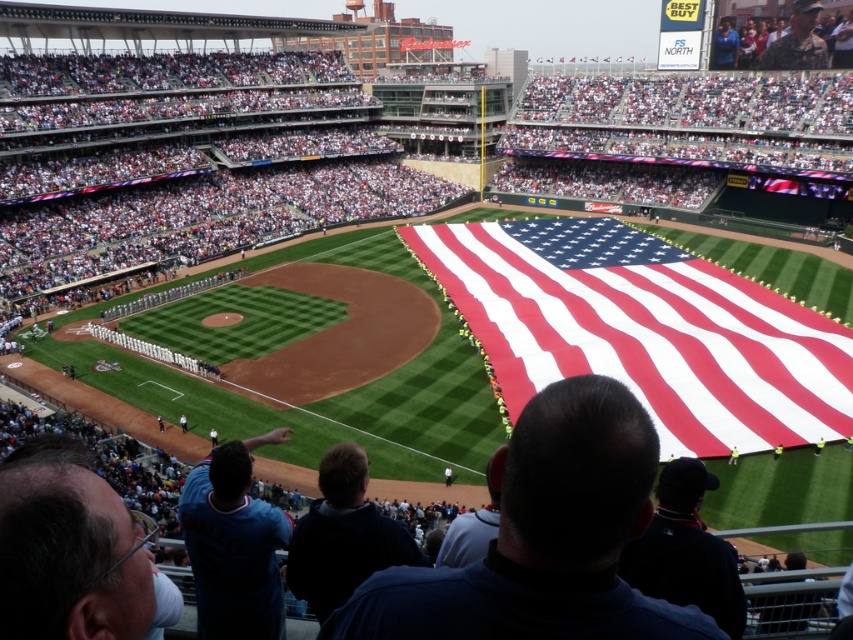
Who is higher up, red-white striped fabric at center or yellow fabric at lower right?

red-white striped fabric at center

Is red-white striped fabric at center smaller than yellow fabric at lower right?

No, red-white striped fabric at center is not smaller than yellow fabric at lower right.

Which is in front, point (825, 323) or point (735, 451)?

Point (735, 451) is in front.

Image resolution: width=853 pixels, height=640 pixels. Find the location of `red-white striped fabric at center`. red-white striped fabric at center is located at coordinates (643, 330).

Which of these two, red-white striped fabric at center or blue jersey at lower left, stands taller?

With more height is red-white striped fabric at center.

In the scene shown: Who is more distant from viewer, (511, 301) or (285, 541)?

The point (511, 301) is more distant.

Is point (734, 310) in front of point (253, 616)?

No, (734, 310) is behind (253, 616).

At what (x,y) coordinates should I click in order to perform the action: click on red-white striped fabric at center. Please return your answer as a coordinate pair (x, y). Image resolution: width=853 pixels, height=640 pixels. Looking at the image, I should click on (643, 330).

Is blue jersey at lower left above yellow fabric at lower right?

Indeed, blue jersey at lower left is positioned over yellow fabric at lower right.

Is blue jersey at lower left to the left of yellow fabric at lower right from the viewer's perspective?

Correct, you'll find blue jersey at lower left to the left of yellow fabric at lower right.

Locate an element on the screen. The height and width of the screenshot is (640, 853). blue jersey at lower left is located at coordinates tap(234, 545).

At what (x,y) coordinates should I click in order to perform the action: click on blue jersey at lower left. Please return your answer as a coordinate pair (x, y). Looking at the image, I should click on (234, 545).